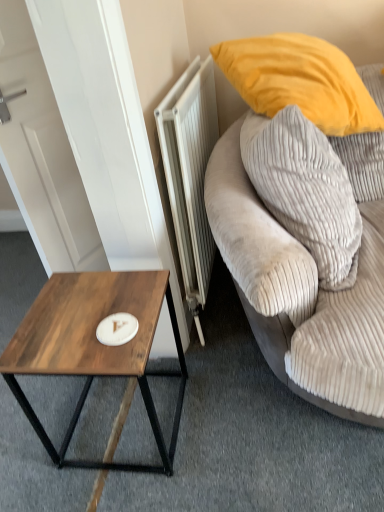
Where is `free space on the front side of white matte plate at center`? free space on the front side of white matte plate at center is located at coordinates (112, 357).